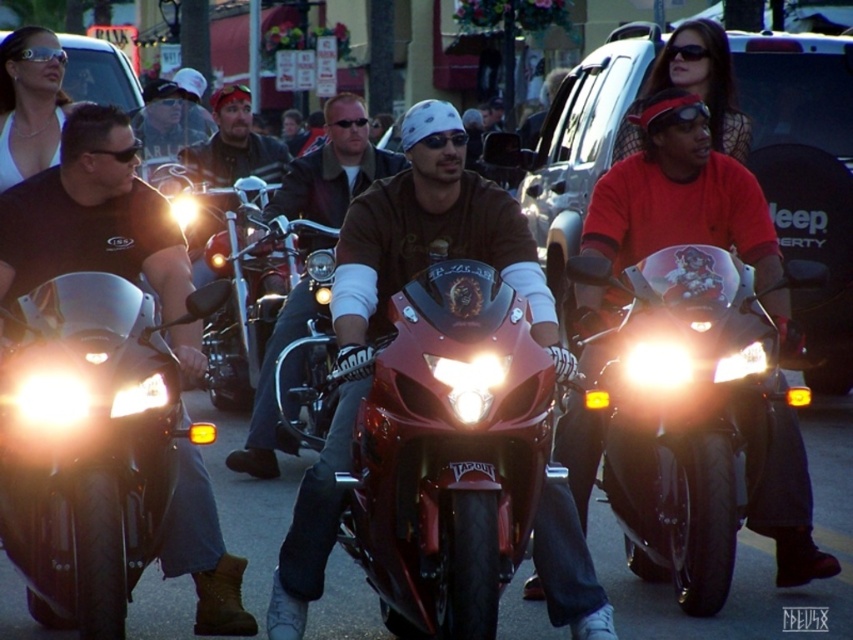
You are a photographer positioned at the side of the road capturing the motorcyclists. You want to take a photo that includes both the shiny chrome motorcycle at left and the matte black motorcycle at center. Given their widths, which motorcycle should you frame closer to the edge of the photo to ensure both fit in the shot?

The shiny chrome motorcycle at left has a lesser width compared to the matte black motorcycle at center. To ensure both fit in the shot, frame the wider matte black motorcycle at center closer to the edge of the photo, leaving more space for the narrower shiny chrome motorcycle at left.

What is the location of the point with coordinates (450, 452) in the image?

The point with coordinates (450, 452) is located on the shiny red motorcycle at center.